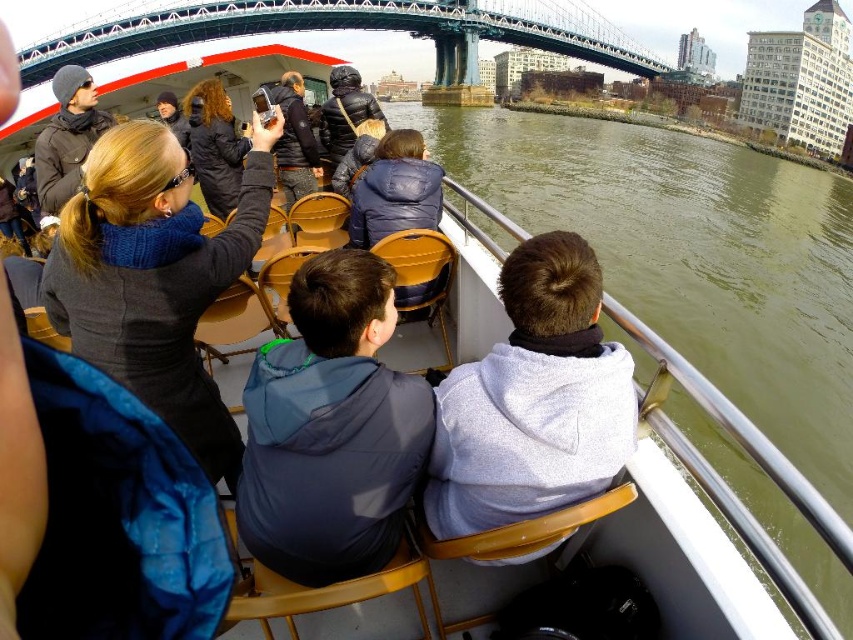
You are a photographer on the boat and want to capture a photo of both the dark gray sweater at upper left and the matte black jacket at left. Since you have a camera with a limited zoom, you need to know which one is taller. Can you tell me which is taller?

The dark gray sweater at upper left is taller than the matte black jacket at left, so you should focus on capturing the dark gray sweater at upper left first as it occupies more vertical space in the frame.

You are a photographer on the boat and want to take a photo of the dark gray sweater at upper left and the matte black jacket at left. Which object is closer to the camera?

The dark gray sweater at upper left is closer to the camera because it is in front of the matte black jacket at left.